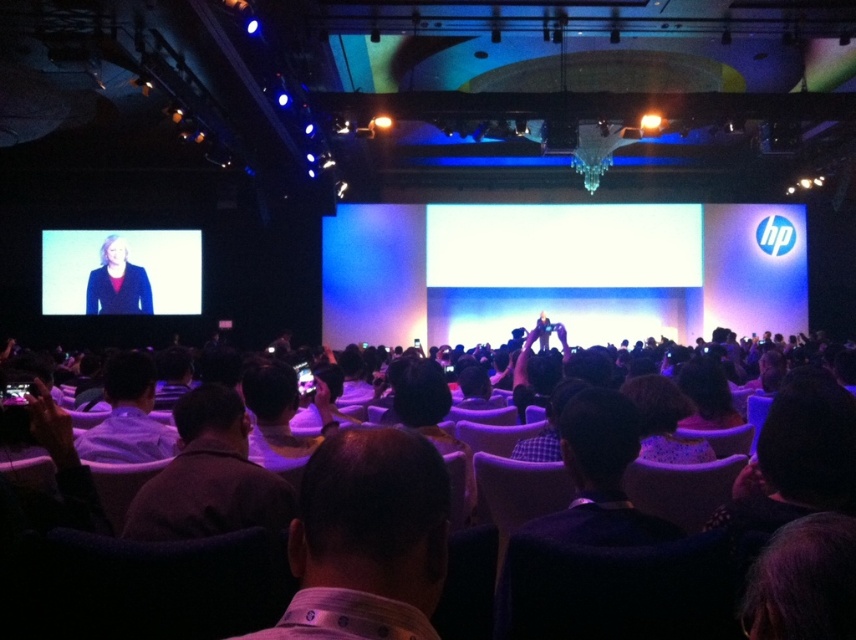
Is matte black jacket at upper left below white shirt at lower left?

Actually, matte black jacket at upper left is above white shirt at lower left.

Is matte black jacket at upper left to the right of white shirt at lower left from the viewer's perspective?

No, matte black jacket at upper left is not to the right of white shirt at lower left.

Locate an element on the screen. matte black jacket at upper left is located at coordinates (120, 272).

The image size is (856, 640). Identify the location of matte black jacket at upper left. (120, 272).

Does dark brown shirt at center lie in front of matte black jacket at upper left?

Yes, it is.

Between point (377, 525) and point (171, 262), which one is positioned in front?

Positioned in front is point (377, 525).

Is point (316, 452) farther from camera compared to point (174, 288)?

No, it is not.

This screenshot has width=856, height=640. Find the location of `dark brown shirt at center`. dark brown shirt at center is located at coordinates (367, 540).

Between matte black jacket at upper left and matte black jacket at left, which one appears on the left side from the viewer's perspective?

matte black jacket at upper left is more to the left.

Is matte black jacket at upper left below matte black jacket at left?

Actually, matte black jacket at upper left is above matte black jacket at left.

I want to click on matte black jacket at upper left, so click(120, 272).